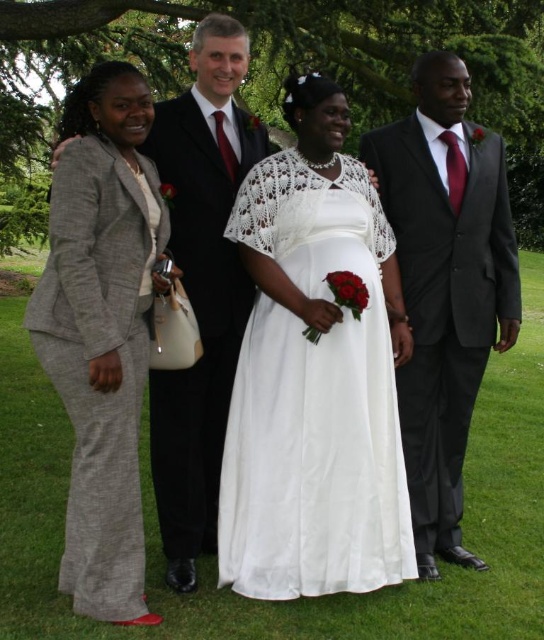
Can you confirm if gray wool suit at left is positioned above matte black suit at center?

No, gray wool suit at left is not above matte black suit at center.

Can you confirm if gray wool suit at left is positioned below matte black suit at center?

Correct, gray wool suit at left is located below matte black suit at center.

Does point (126, 179) come in front of point (215, 493)?

That is True.

The image size is (544, 640). I want to click on gray wool suit at left, so click(102, 330).

Does gray wool suit at left appear over matte black suit at right?

Incorrect, gray wool suit at left is not positioned above matte black suit at right.

This screenshot has height=640, width=544. I want to click on gray wool suit at left, so coord(102,330).

Does point (473, 38) come closer to viewer compared to point (217, 193)?

No, it is not.

Is the position of green leafy tree at center more distant than that of matte black suit at center?

Yes, it is behind matte black suit at center.

Identify the location of green leafy tree at center. (276, 72).